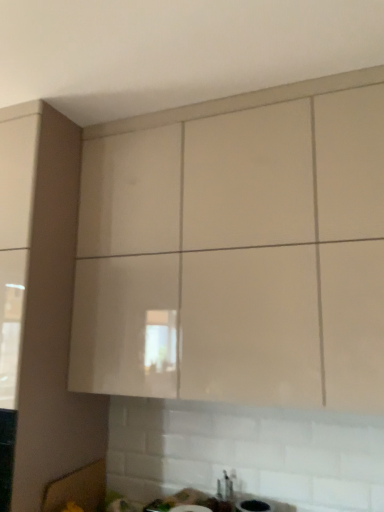
Question: From the image's perspective, does white glossy sink at lower center appear higher than matte beige cabinet at upper center?

Choices:
 (A) no
 (B) yes

Answer: (A)

Question: Does white glossy sink at lower center lie behind matte beige cabinet at upper center?

Choices:
 (A) yes
 (B) no

Answer: (A)

Question: Is white glossy sink at lower center wider than matte beige cabinet at upper center?

Choices:
 (A) yes
 (B) no

Answer: (B)

Question: From a real-world perspective, is white glossy sink at lower center beneath matte beige cabinet at upper center?

Choices:
 (A) yes
 (B) no

Answer: (A)

Question: Would you say white glossy sink at lower center is a long distance from matte beige cabinet at upper center?

Choices:
 (A) no
 (B) yes

Answer: (A)

Question: Considering the relative positions of white glossy sink at lower center and matte beige cabinet at upper center in the image provided, is white glossy sink at lower center to the right of matte beige cabinet at upper center from the viewer's perspective?

Choices:
 (A) yes
 (B) no

Answer: (B)

Question: Is matte beige cabinet at upper center smaller than white glossy sink at lower center?

Choices:
 (A) yes
 (B) no

Answer: (B)

Question: Is matte beige cabinet at upper center taller than white glossy sink at lower center?

Choices:
 (A) yes
 (B) no

Answer: (A)

Question: Would you say matte beige cabinet at upper center contains white glossy sink at lower center?

Choices:
 (A) no
 (B) yes

Answer: (A)

Question: Is matte beige cabinet at upper center shorter than white glossy sink at lower center?

Choices:
 (A) no
 (B) yes

Answer: (A)

Question: Is matte beige cabinet at upper center closer to the viewer compared to white glossy sink at lower center?

Choices:
 (A) yes
 (B) no

Answer: (A)

Question: Is matte beige cabinet at upper center oriented towards white glossy sink at lower center?

Choices:
 (A) no
 (B) yes

Answer: (A)

Question: Relative to white glossy sink at lower center, is matte beige cabinet at upper center in front or behind?

Choices:
 (A) behind
 (B) front

Answer: (B)